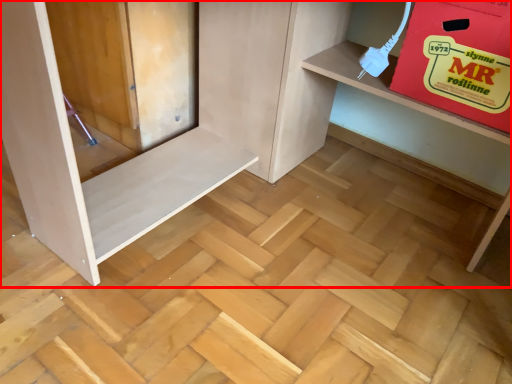
Question: From the image's perspective, where is furniture (annotated by the red box) located in relation to cardboard box in the image?

Choices:
 (A) below
 (B) above

Answer: (A)